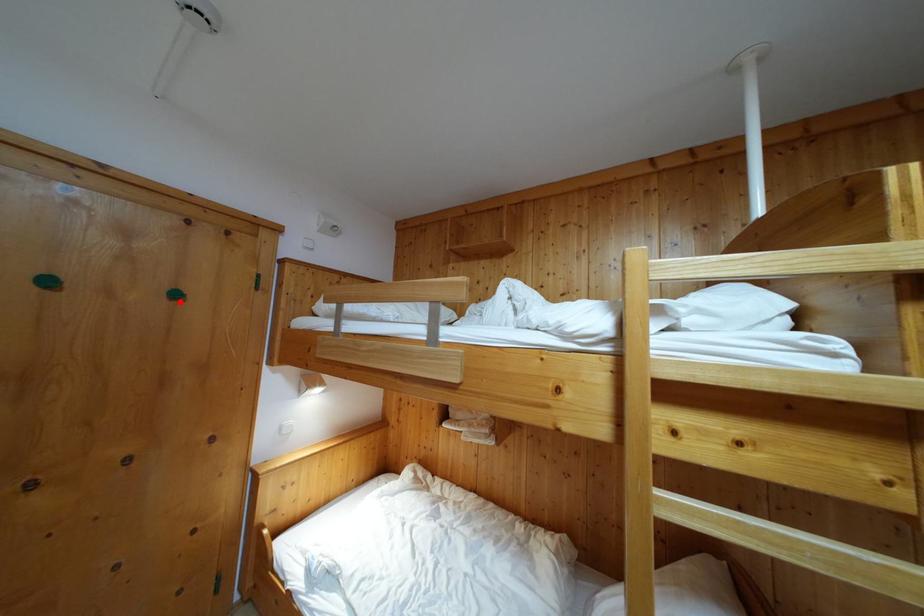
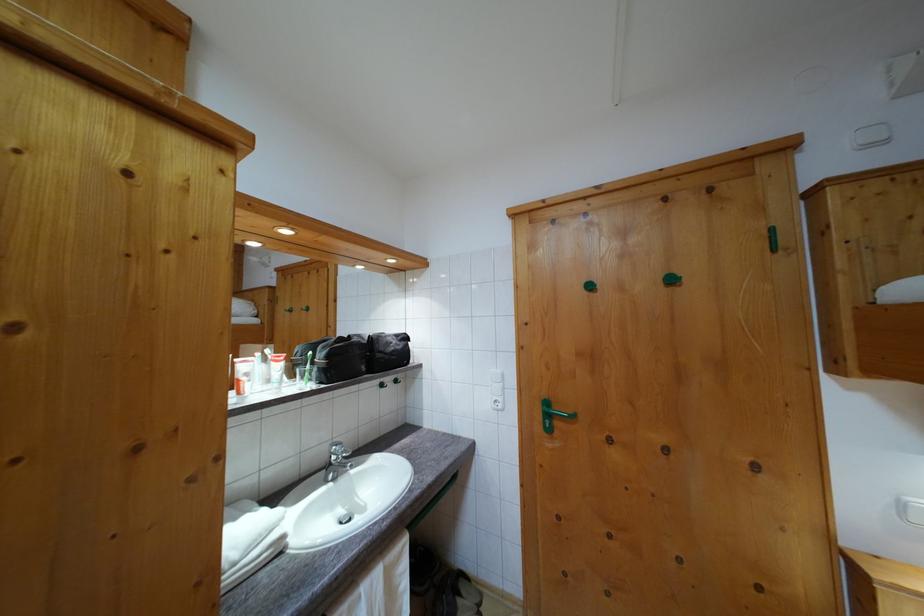
In the second image, find the point that corresponds to the highlighted location in the first image.

(675, 286)